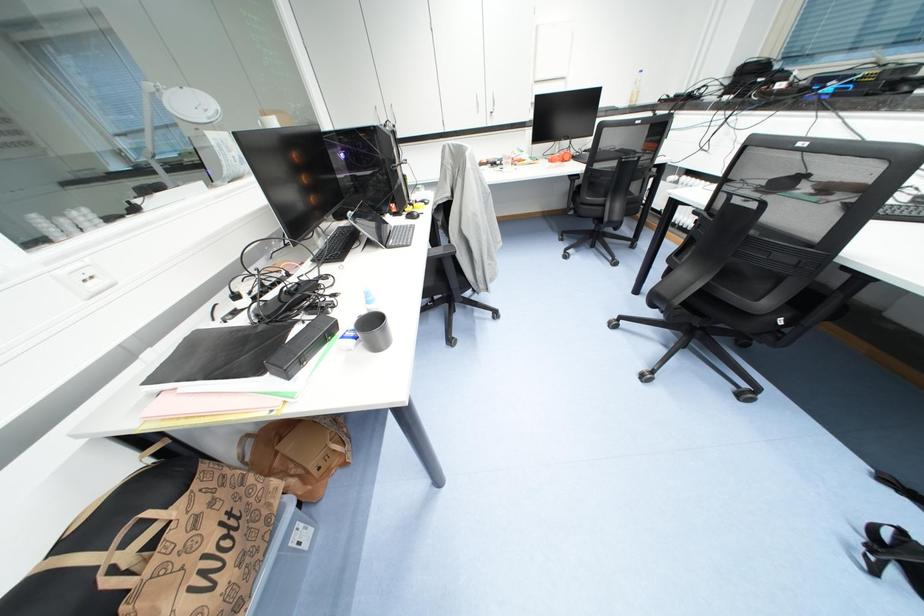
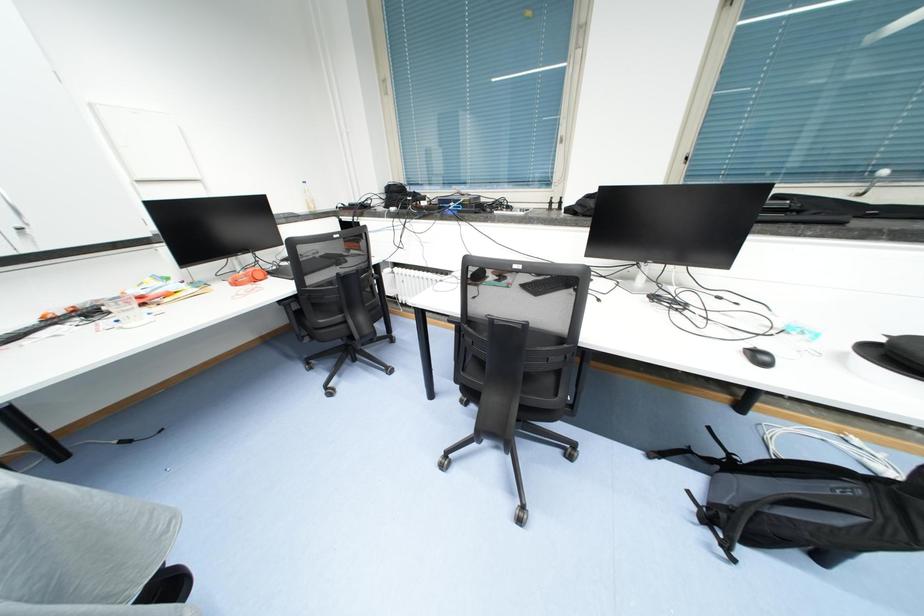
Question: The images are taken continuously from a first-person perspective. In which direction is your viewpoint rotating?

Choices:
 (A) Left
 (B) Right
 (C) Up
 (D) Down

Answer: (B)